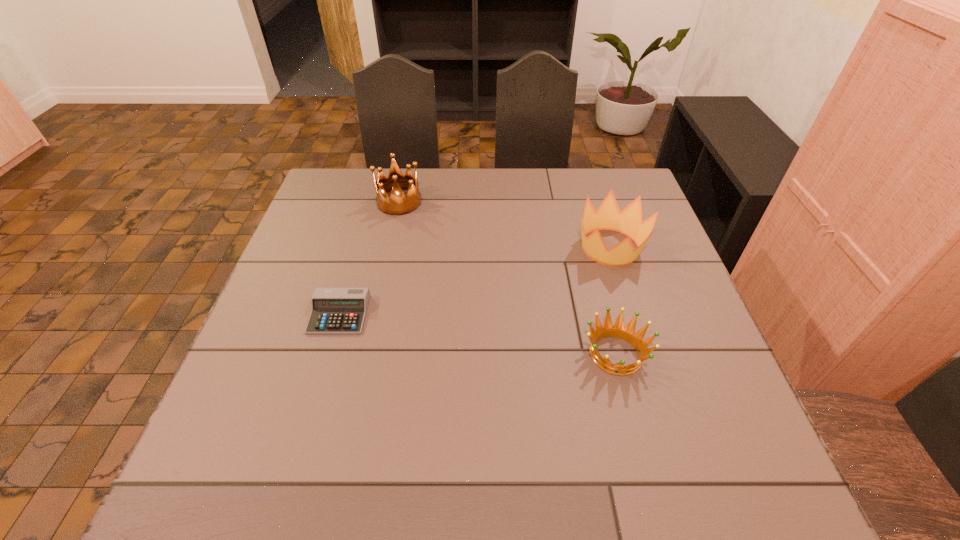
Where is `object located at the far edge`? The width and height of the screenshot is (960, 540). object located at the far edge is located at coordinates (398, 204).

You are a GUI agent. You are given a task and a screenshot of the screen. Output one action in this format:
    pyautogui.click(x=<x>, y=<y>)
    Task: Click on the object at the left edge
    
    Given the screenshot: What is the action you would take?
    pyautogui.click(x=333, y=310)

Locate an element on the screen. The image size is (960, 540). vacant region at the far edge of the desktop is located at coordinates (559, 204).

I want to click on vacant area at the near edge, so click(x=575, y=473).

Locate an element on the screen. vacant space at the right edge of the desktop is located at coordinates (671, 399).

Image resolution: width=960 pixels, height=540 pixels. I want to click on free space between the second farthest crown and the shortest crown, so click(612, 301).

Where is `empty space between the second nearest crown and the nearest crown`? Image resolution: width=960 pixels, height=540 pixels. empty space between the second nearest crown and the nearest crown is located at coordinates (612, 301).

At what (x,y) coordinates should I click in order to perform the action: click on vacant space that's between the second shortest object and the second nearest crown. Please return your answer as a coordinate pair (x, y). The width and height of the screenshot is (960, 540). Looking at the image, I should click on coord(612,301).

Find the location of a particular element. This screenshot has height=540, width=960. free area in between the second farthest crown and the calculator is located at coordinates (475, 281).

Find the location of a particular element. vacant region between the leftmost crown and the second farthest object is located at coordinates (505, 225).